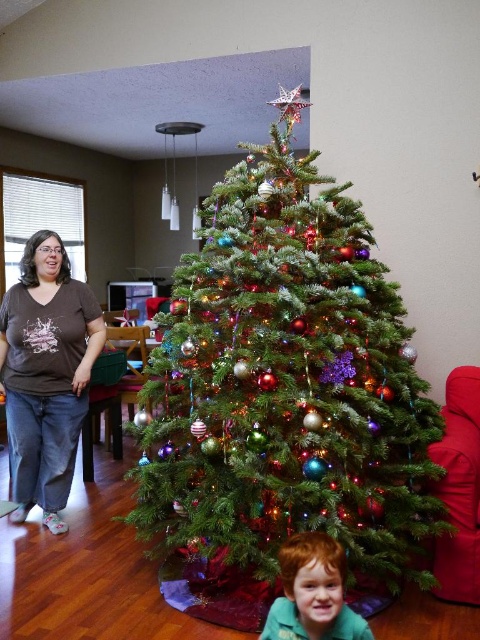
You are a photographer trying to capture a full view of the green matte christmas tree at center and the brown cotton shirt at left in one shot. Based on their sizes, which object would require you to step back more to include its entire height in the photo?

The green matte christmas tree at center is much taller than the brown cotton shirt at left, so you would need to step back more to include its entire height in the photo.

You are standing in the room and want to see the young child peeking behind the green matte Christmas tree at center. Which direction should you move to get a better view of the child?

Since the green matte Christmas tree at center is located at point (x=287, y=381), you should move to the left or right of the tree to get a better view of the child who is peeking from behind it.